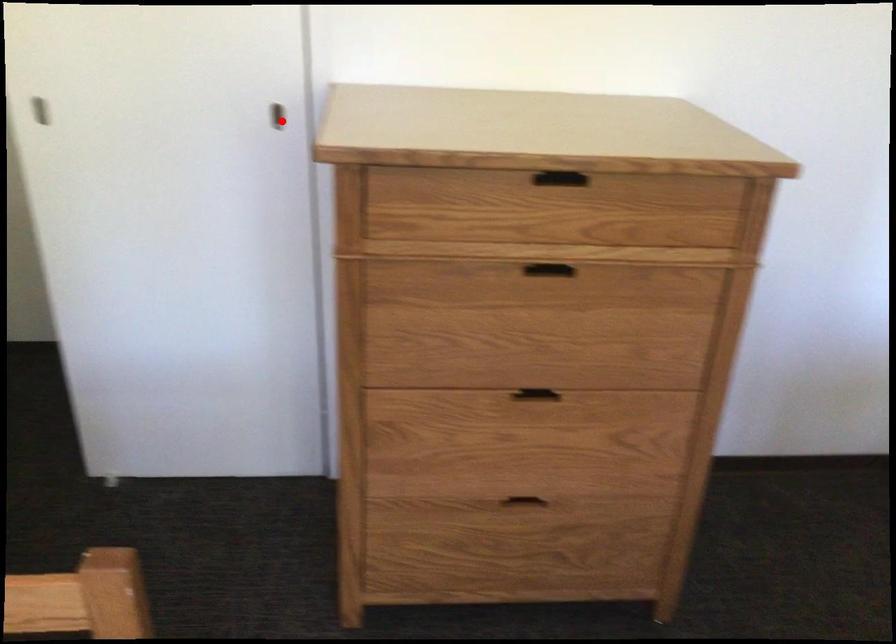
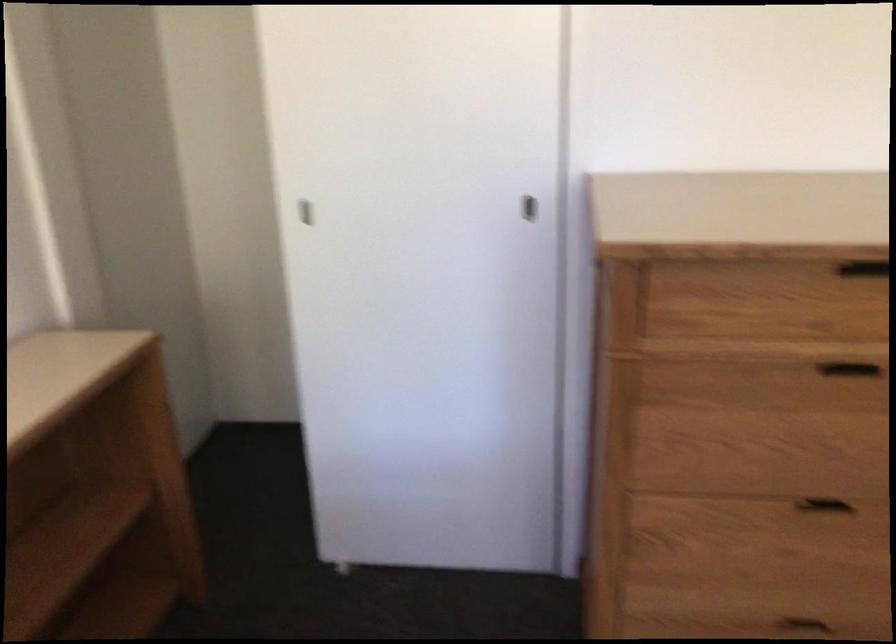
The point at the highlighted location is marked in the first image. Where is the corresponding point in the second image?

(530, 209)